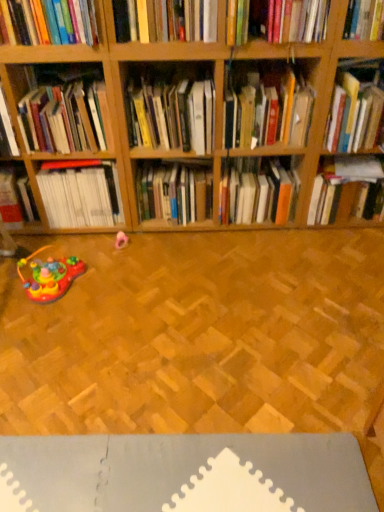
Find the location of a particular element. This screenshot has width=384, height=512. vacant space underneath gray foam mat at lower center (from a real-world perspective) is located at coordinates (170, 477).